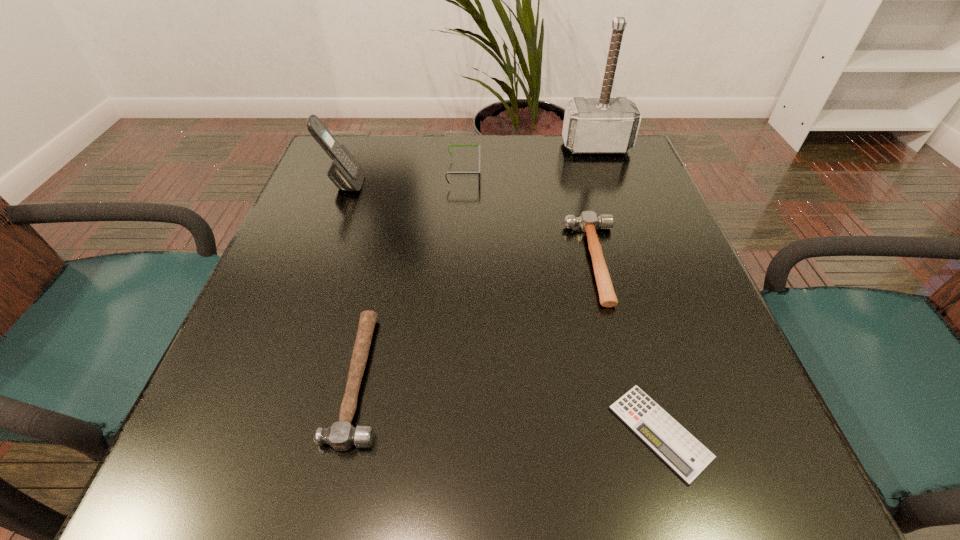
Find the location of a particular element. the tallest hammer is located at coordinates (604, 125).

Where is `the farthest object`? The image size is (960, 540). the farthest object is located at coordinates (604, 125).

The height and width of the screenshot is (540, 960). What are the coordinates of `cellular telephone` in the screenshot? It's located at (345, 172).

This screenshot has width=960, height=540. Find the location of `the leftmost object`. the leftmost object is located at coordinates (345, 172).

Find the location of `the third object from left to right`. the third object from left to right is located at coordinates (449, 145).

At what (x,y) coordinates should I click in order to perform the action: click on the third tallest object. Please return your answer as a coordinate pair (x, y). Image resolution: width=960 pixels, height=540 pixels. Looking at the image, I should click on (449, 145).

In order to click on the fourth farthest object in this screenshot , I will do `click(588, 221)`.

Image resolution: width=960 pixels, height=540 pixels. In order to click on the leftmost hammer in this screenshot , I will do `click(342, 435)`.

The height and width of the screenshot is (540, 960). I want to click on the second object from left to right, so click(x=342, y=435).

The width and height of the screenshot is (960, 540). Identify the location of the shortest object. 685,455.